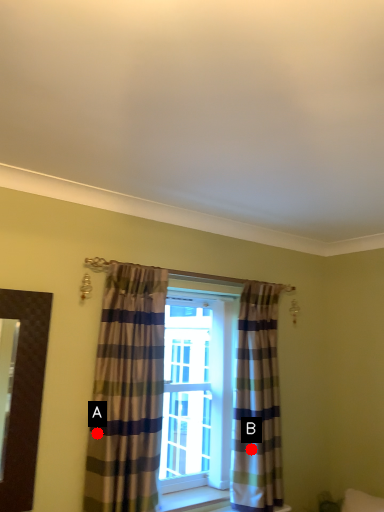
Question: Two points are circled on the image, labeled by A and B beside each circle. Which point is farther to the camera?

Choices:
 (A) A is further
 (B) B is further

Answer: (B)